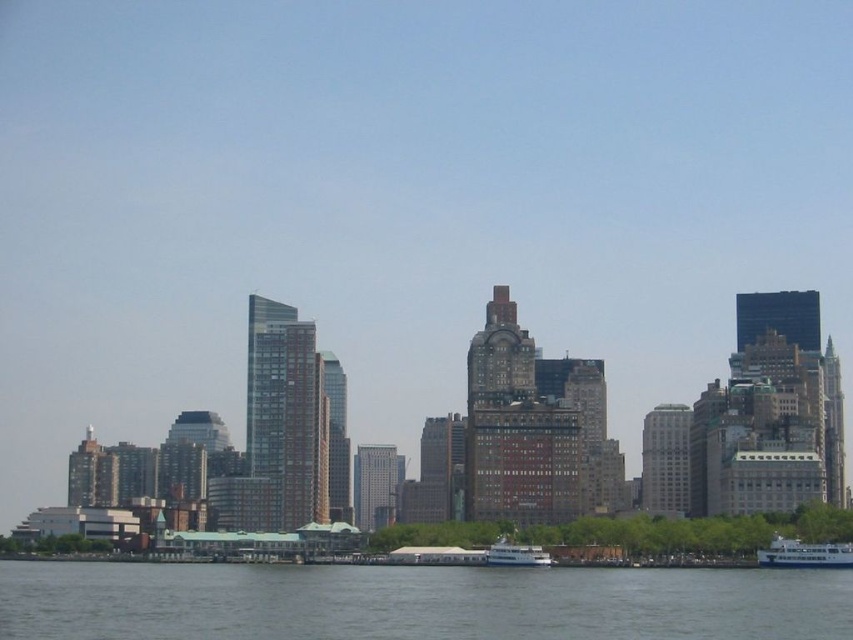
You are a photographer planning to take a wide shot of the city skyline. You notice the gray water at lower center and the white glossy boat at lower right in your frame. Considering their sizes in the image, which object should you focus on to ensure the boat remains visible without being too small?

The gray water at lower center has a larger size compared to the white glossy boat at lower right. To ensure the boat remains visible without being too small, focus on the white glossy boat at lower right since it is smaller and needs attention to detail.

You are a photographer standing on the shore and want to capture both the white glossy boat at lower right and the white glossy boat at lower center in a single shot. Which boat should you position closer to the edge of your camera frame to include both?

You should position the white glossy boat at lower center closer to the edge of your camera frame because the white glossy boat at lower right is located above it, allowing both to fit within the frame when the lower one is near the edge.